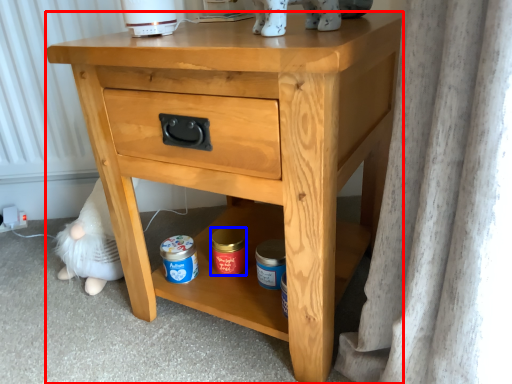
Question: Among these objects, which one is farthest to the camera, nightstand (highlighted by a red box) or pottery (highlighted by a blue box)?

Choices:
 (A) nightstand
 (B) pottery

Answer: (B)